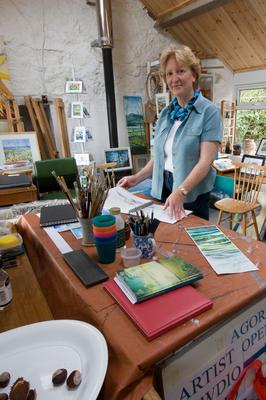
Identify the location of chair. (244, 203).